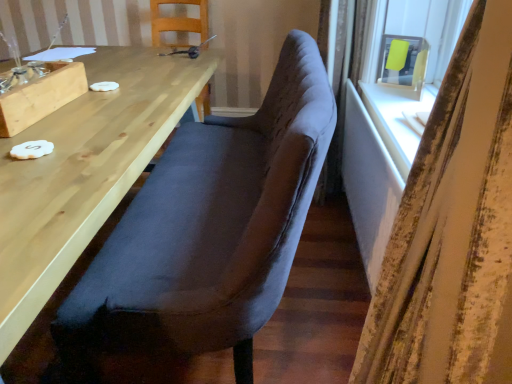
Question: Looking at the image, does wooden table at left, placed as the 2th table when sorted from right to left, seem bigger or smaller compared to white textured curtain at right?

Choices:
 (A) big
 (B) small

Answer: (A)

Question: Is wooden table at left, which is the 1th table from left to right, in front of or behind white textured curtain at right in the image?

Choices:
 (A) behind
 (B) front

Answer: (A)

Question: Which object is the farthest from the white painted wood table at right, the 1th table from the right?

Choices:
 (A) velvet-like dark brown bench at center, the second chair positioned from the back
 (B) wooden table at left, which is the 1th table from left to right
 (C) velvet dark blue chair at upper center, which is the 2th chair from front to back
 (D) white textured curtain at right
 (E) matte yellow paper at upper right

Answer: (C)

Question: Estimate the real-world distances between objects in this image. Which object is closer to the matte yellow paper at upper right?

Choices:
 (A) white textured curtain at right
 (B) wooden table at left, placed as the 2th table when sorted from right to left
 (C) velvet-like dark brown bench at center, the second chair positioned from the back
 (D) velvet dark blue chair at upper center, which is the 2th chair from front to back
 (E) white painted wood table at right, the 1th table from the right

Answer: (E)